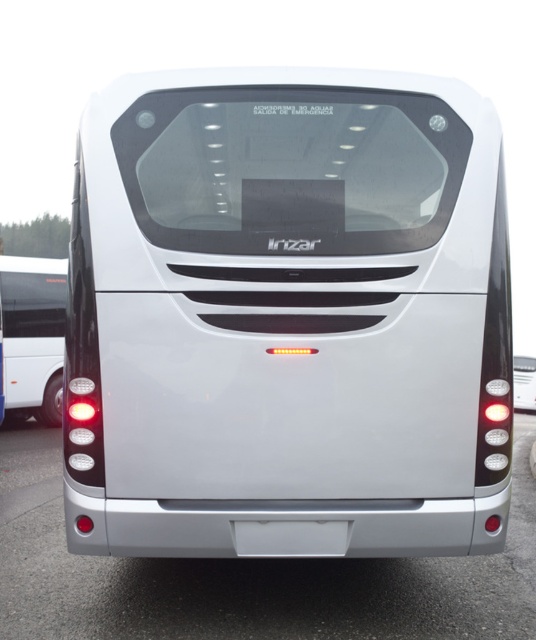
Question: Can you confirm if glossy metallic bus at lower center is positioned to the left of silver metallic bus at left?

Choices:
 (A) no
 (B) yes

Answer: (A)

Question: Which object appears closest to the camera in this image?

Choices:
 (A) silver metallic bus at left
 (B) white glossy bus at center

Answer: (B)

Question: Based on their relative distances, which object is farther from the silver metallic bus at left?

Choices:
 (A) glossy metallic bus at lower center
 (B) white glossy bus at center

Answer: (A)

Question: Which is farther from the silver metallic bus at left?

Choices:
 (A) glossy metallic bus at lower center
 (B) white glossy bus at center

Answer: (A)

Question: Is glossy metallic bus at lower center thinner than silver metallic bus at left?

Choices:
 (A) yes
 (B) no

Answer: (A)

Question: Can you confirm if glossy metallic bus at lower center is bigger than silver metallic bus at left?

Choices:
 (A) no
 (B) yes

Answer: (A)